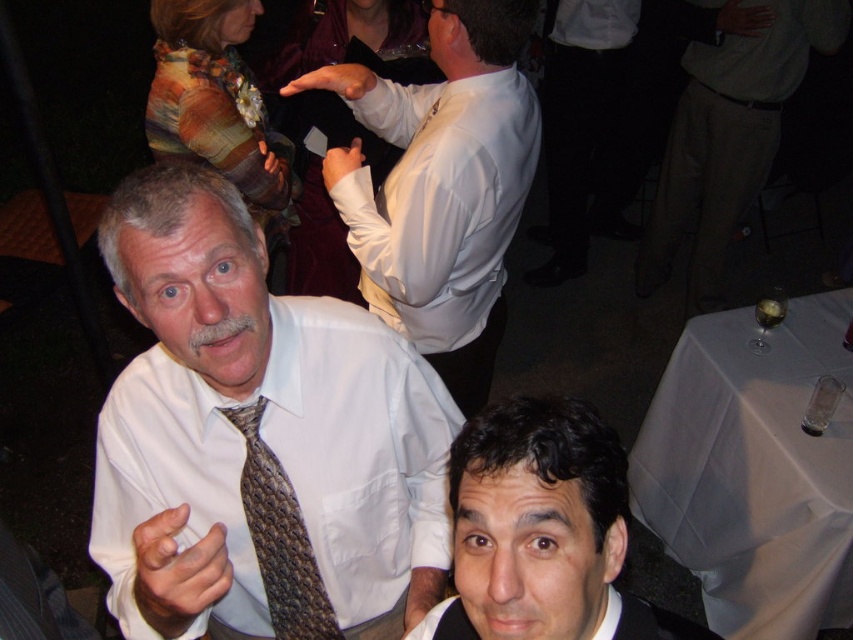
Question: Which object appears farthest from the camera in this image?

Choices:
 (A) white satin shirt at upper center
 (B) smooth black hair at lower right
 (C) white textured shirt at center

Answer: (A)

Question: Can you confirm if white textured shirt at center is positioned to the left of smooth black hair at lower right?

Choices:
 (A) yes
 (B) no

Answer: (A)

Question: Is white satin shirt at upper center to the left of khaki pants at lower right from the viewer's perspective?

Choices:
 (A) yes
 (B) no

Answer: (A)

Question: Does khaki pants at lower right appear over textured brown tie at center?

Choices:
 (A) no
 (B) yes

Answer: (B)

Question: Which object appears farthest from the camera in this image?

Choices:
 (A) white textured shirt at center
 (B) smooth black hair at lower right
 (C) khaki pants at lower right

Answer: (C)

Question: Which point appears closest to the camera in this image?

Choices:
 (A) (820, 32)
 (B) (525, 573)

Answer: (B)